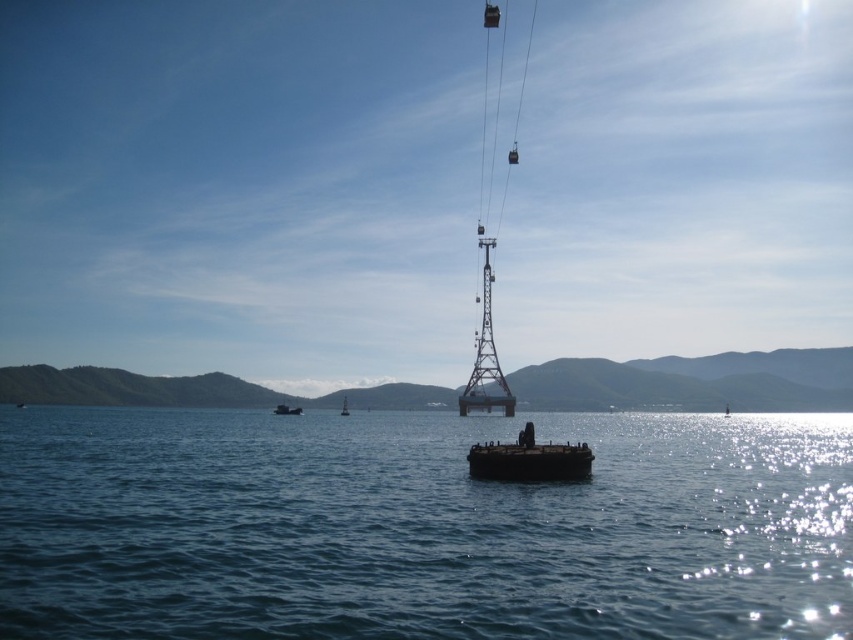
Question: Is blue water at center bigger than metallic gray buoy at center?

Choices:
 (A) no
 (B) yes

Answer: (B)

Question: Does blue water at center have a lesser width compared to dark matte barge at center?

Choices:
 (A) no
 (B) yes

Answer: (A)

Question: Which object is closer to the camera taking this photo?

Choices:
 (A) blue water at center
 (B) metallic gray buoy at center
 (C) dark brown wooden boat at center

Answer: (A)

Question: Does dark matte barge at center have a lesser width compared to dark brown wooden boat at center?

Choices:
 (A) yes
 (B) no

Answer: (A)

Question: Which point is closer to the camera taking this photo?

Choices:
 (A) (345, 396)
 (B) (556, 444)

Answer: (B)

Question: Which of the following is the closest to the observer?

Choices:
 (A) dark matte barge at center
 (B) blue water at center
 (C) dark brown wooden boat at center

Answer: (B)